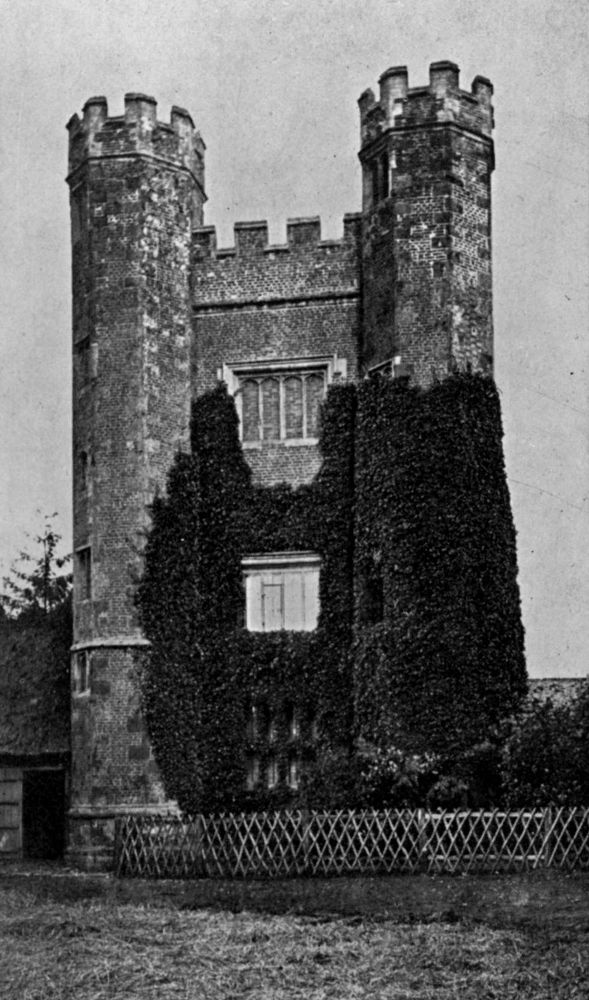
Find the location of a particular element. This screenshot has width=589, height=1000. wall is located at coordinates (555, 689).